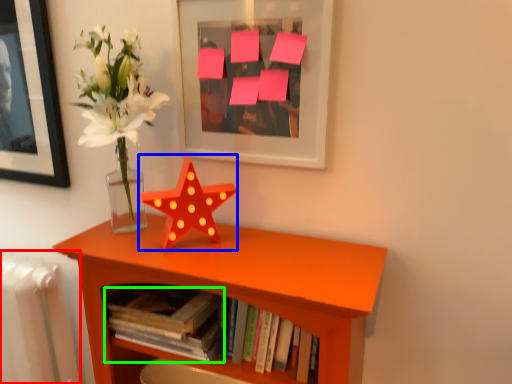
Question: Which object is the closest to the radiator (highlighted by a red box)? Choose among these: flower (highlighted by a blue box) or book (highlighted by a green box).

Choices:
 (A) flower
 (B) book

Answer: (B)